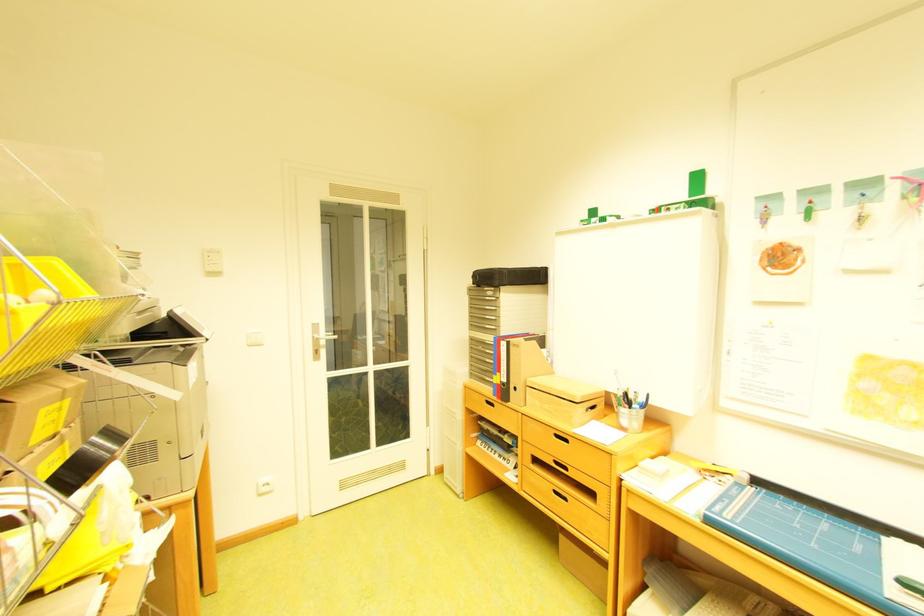
The location [806,541] corresponds to which object?

This point indicates the blue binder.